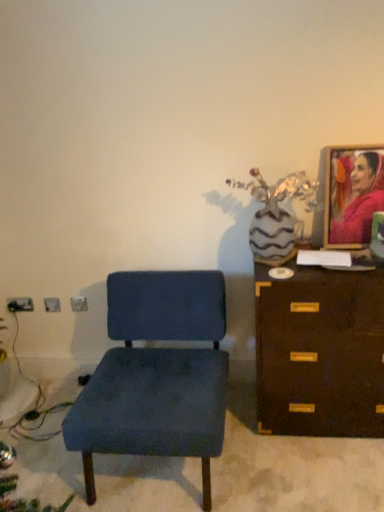
Locate an element on the screen. This screenshot has height=512, width=384. free area in between brown wooden chest of drawers at right and velvet blue chair at center is located at coordinates (299, 466).